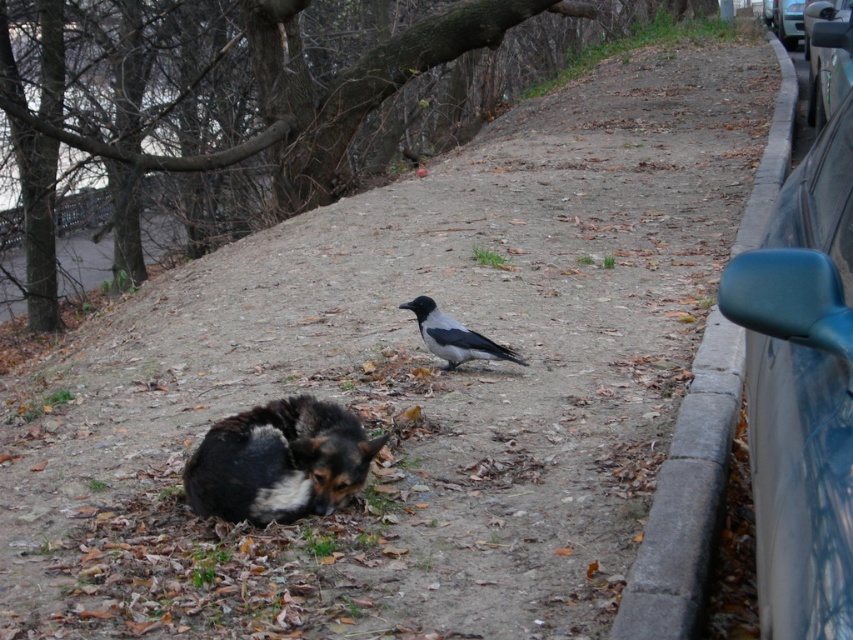
Can you confirm if gray matte bird at center is shorter than metallic blue car at right?

Yes.

Image resolution: width=853 pixels, height=640 pixels. What do you see at coordinates (453, 337) in the screenshot?
I see `gray matte bird at center` at bounding box center [453, 337].

Is point (463, 344) more distant than point (798, 36)?

No, it is in front of (798, 36).

You are a GUI agent. You are given a task and a screenshot of the screen. Output one action in this format:
    pyautogui.click(x=<x>, y=<y>)
    Task: Click on the gray matte bird at center
    
    Given the screenshot: What is the action you would take?
    pyautogui.click(x=453, y=337)

Is metallic blue car mirror at right shorter than gray concrete curb at right?

Yes.

Looking at this image, can you confirm if metallic blue car mirror at right is positioned to the right of gray concrete curb at right?

Incorrect, metallic blue car mirror at right is not on the right side of gray concrete curb at right.

Is point (753, 278) less distant than point (683, 614)?

Yes, point (753, 278) is closer to viewer.

The width and height of the screenshot is (853, 640). In order to click on metallic blue car mirror at right in this screenshot , I will do point(801,392).

Which is more to the right, gray concrete curb at right or gray matte bird at center?

Positioned to the right is gray concrete curb at right.

Who is shorter, gray concrete curb at right or gray matte bird at center?

Standing shorter between the two is gray matte bird at center.

Which is behind, point (782, 80) or point (437, 326)?

Positioned behind is point (782, 80).

Where is `gray concrete curb at right`? The width and height of the screenshot is (853, 640). gray concrete curb at right is located at coordinates (686, 497).